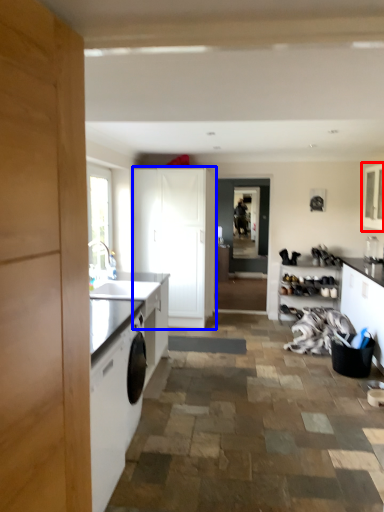
Question: Which object is closer to the camera taking this photo, cabinetry (highlighted by a red box) or cabinetry (highlighted by a blue box)?

Choices:
 (A) cabinetry
 (B) cabinetry

Answer: (A)